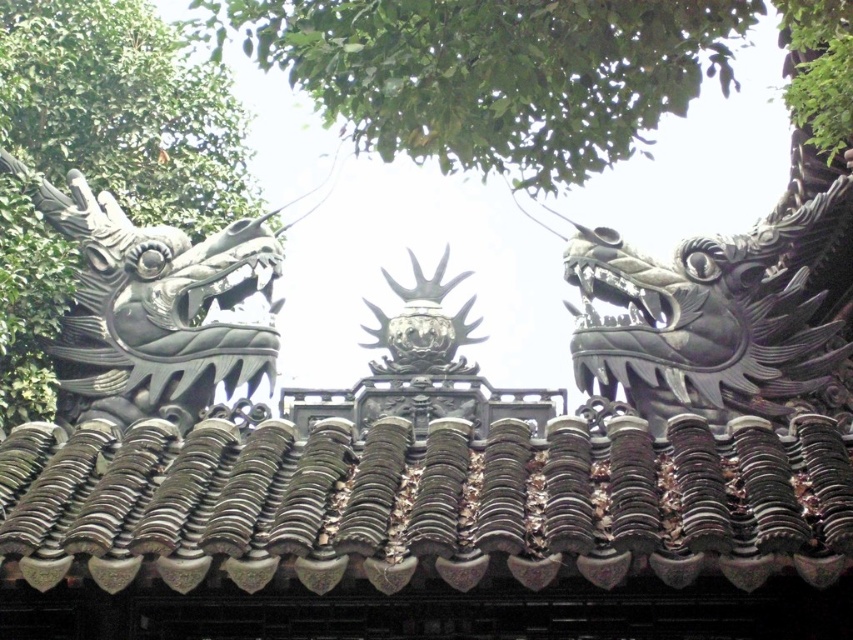
Is point (155, 566) closer to camera compared to point (102, 276)?

Yes, point (155, 566) is in front of point (102, 276).

Between dark gray textured tiles at center and black matte dragon head at left, which one appears on the right side from the viewer's perspective?

dark gray textured tiles at center

This screenshot has height=640, width=853. What are the coordinates of `dark gray textured tiles at center` in the screenshot? It's located at (424, 500).

Is shiny black dragon at right to the right of black matte dragon head at left from the viewer's perspective?

Correct, you'll find shiny black dragon at right to the right of black matte dragon head at left.

Which is behind, point (618, 355) or point (112, 257)?

The point (112, 257) is behind.

Image resolution: width=853 pixels, height=640 pixels. Identify the location of shiny black dragon at right. (712, 317).

Who is taller, green leafy tree at upper center or shiny black dragon at right?

Standing taller between the two is shiny black dragon at right.

Image resolution: width=853 pixels, height=640 pixels. What do you see at coordinates (492, 74) in the screenshot?
I see `green leafy tree at upper center` at bounding box center [492, 74].

Does point (386, 129) come in front of point (766, 276)?

Yes, it is.

Where is `green leafy tree at upper center`? This screenshot has height=640, width=853. green leafy tree at upper center is located at coordinates (492, 74).